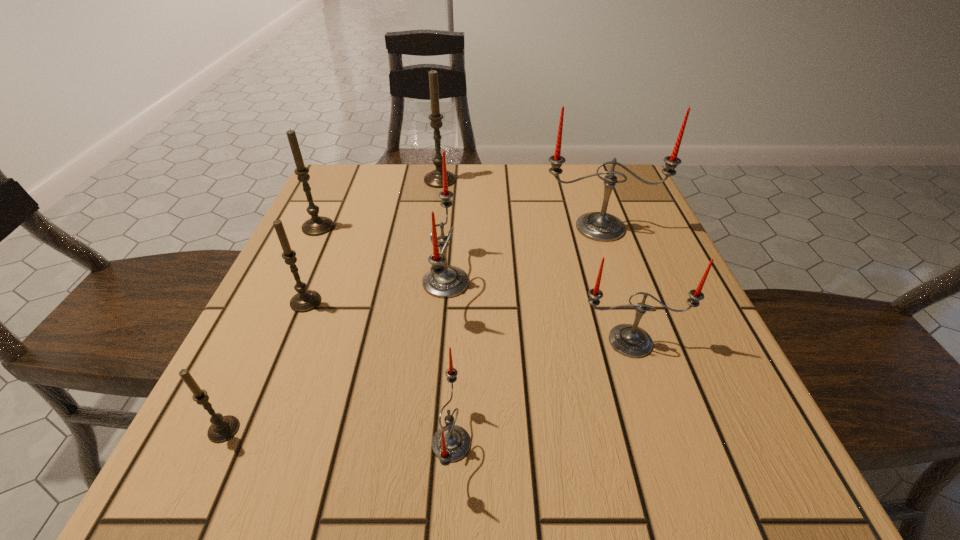
Select which red candle is the second closest to the third farthest red candle. Please provide its 2D coordinates. Your answer should be formatted as a tuple, i.e. [(x, y)], where the tuple contains the x and y coordinates of a point satisfying the conditions above.

[(451, 443)]

Where is `red candle that stands as the second closest to the second biggest red candle`? The image size is (960, 540). red candle that stands as the second closest to the second biggest red candle is located at coordinates (599, 226).

Locate an element on the screen. The width and height of the screenshot is (960, 540). vacant space that satisfies the following two spatial constraints: 1. on the front-facing side of the farthest red candle; 2. on the front-facing side of the second farthest red candle is located at coordinates (619, 282).

Find the location of a particular element. free spot that satisfies the following two spatial constraints: 1. on the front-facing side of the sixth farthest candle; 2. on the front-facing side of the nearest red candle is located at coordinates (663, 443).

Identify the location of vacant space that satisfies the following two spatial constraints: 1. on the front-facing side of the biggest red candle; 2. on the front-facing side of the nearest red candle. (675, 443).